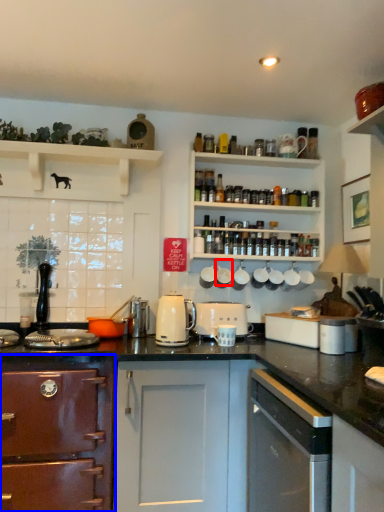
Question: Which object appears closest to the camera in this image, appliance (highlighted by a red box) or cabinetry (highlighted by a blue box)?

Choices:
 (A) appliance
 (B) cabinetry

Answer: (B)